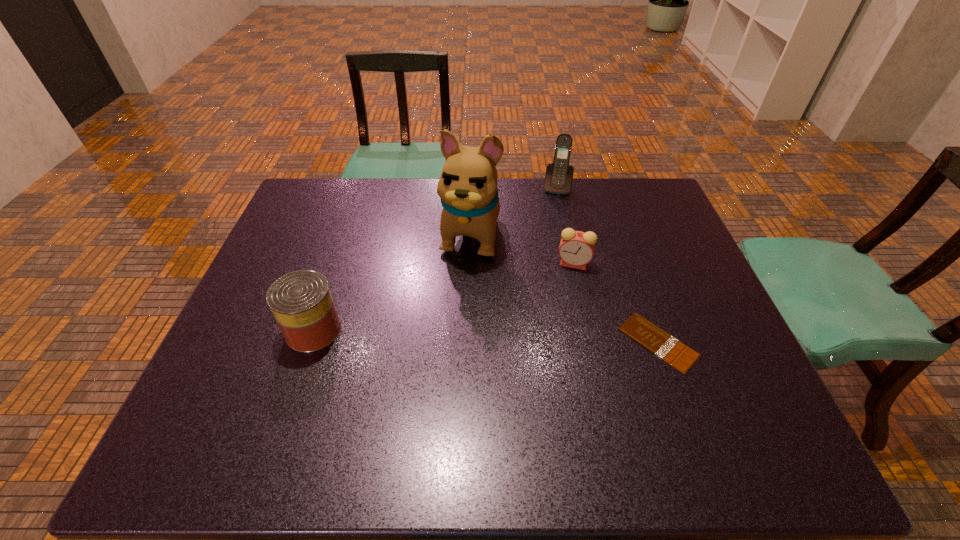
This screenshot has width=960, height=540. Find the location of `vacant space on the desktop that is between the leftmost object and the shortest object and is positioned on the face of the puppy`. vacant space on the desktop that is between the leftmost object and the shortest object and is positioned on the face of the puppy is located at coordinates (438, 334).

The width and height of the screenshot is (960, 540). I want to click on vacant space on the desktop that is between the can and the chocolate bar and is positioned on the face of the fourth tallest object, so click(x=439, y=334).

Identify the location of free spot on the desktop that is between the leftmost object and the shortest object and is positioned on the front-facing side of the cellular telephone. The width and height of the screenshot is (960, 540). (527, 338).